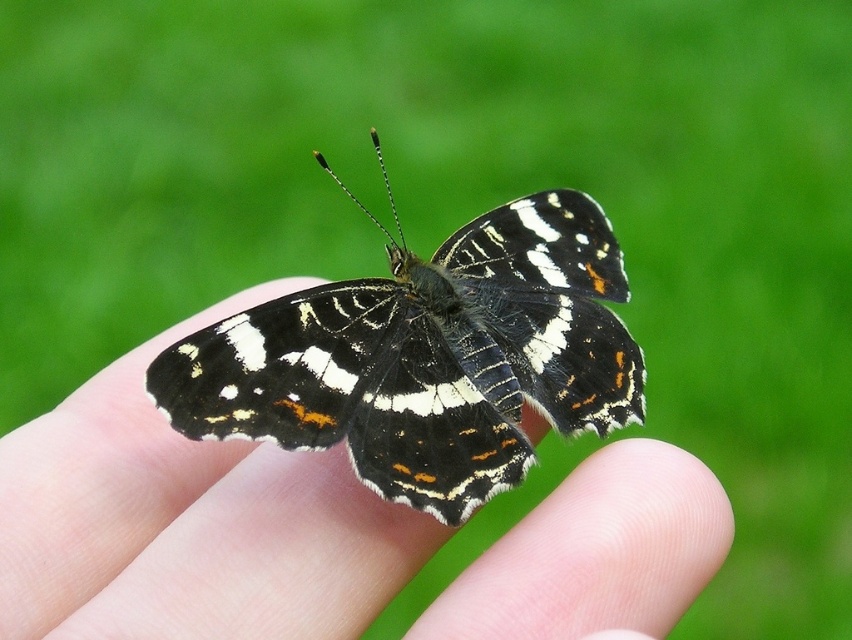
Can you confirm if matte black butterfly at center is bigger than black and white butterfly at center?

Yes.

Does matte black butterfly at center come behind black and white butterfly at center?

No, matte black butterfly at center is in front of black and white butterfly at center.

Between point (344, 570) and point (366, 467), which one is positioned behind?

The point (366, 467) is more distant.

Where is `matte black butterfly at center`? The height and width of the screenshot is (640, 852). matte black butterfly at center is located at coordinates (188, 522).